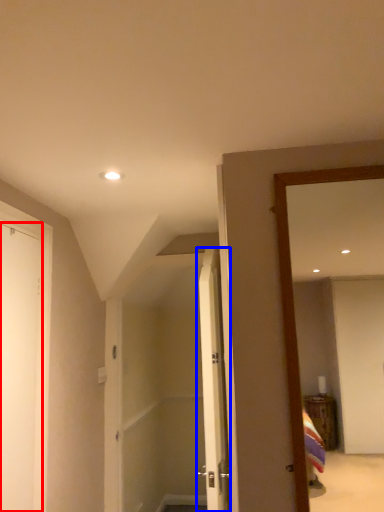
Question: Which point is closer to the camera, door (highlighted by a red box) or door (highlighted by a blue box)?

Choices:
 (A) door
 (B) door

Answer: (A)